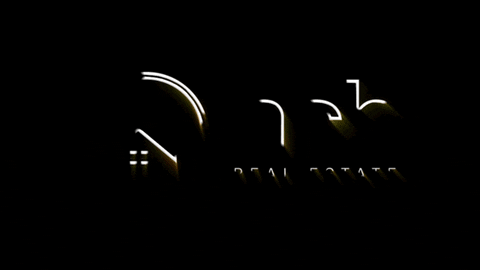
I want to click on window, so click(x=162, y=135), click(x=162, y=142), click(x=171, y=142), click(x=169, y=134).